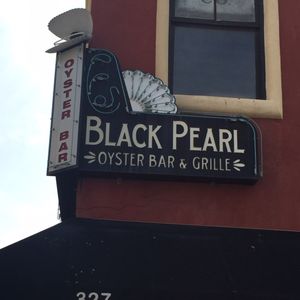
Image resolution: width=300 pixels, height=300 pixels. What are the coordinates of `window` in the screenshot? It's located at (238, 64).